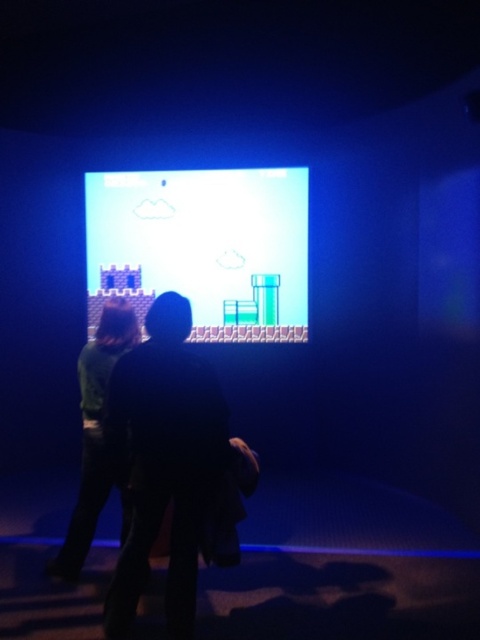
You are designing a new game controller that needs to fit comfortably between the dark fabric jacket at center and the green matte shirt at center. The controller requires a minimum of 15 cm of space. Can the space between them accommodate the controller?

The dark fabric jacket at center is wider than the green matte shirt at center, but the exact distance between them isn

In the scene shown: You are standing in the room and want to touch the point at coordinates point (167, 460). Which object in the scene should you interact with to reach that point?

The point (167, 460) is located on the dark fabric jacket at center, so you should interact with the dark fabric jacket at center to reach that point.

You are a game developer trying to adjust the layout of the scene. Since you need to ensure the pixelated video game at center is visible, where should you place the green matte shirt at center?

The pixelated video game at center is positioned over the green matte shirt at center, so to ensure visibility, the green matte shirt at center should be placed behind the pixelated video game at center.